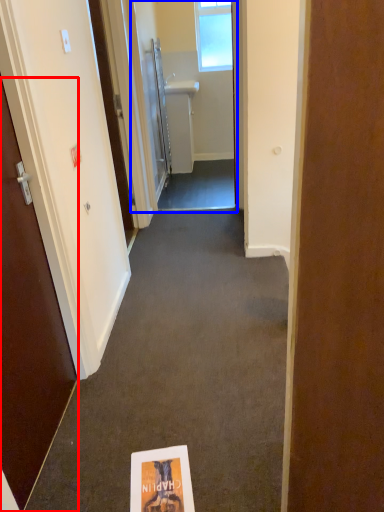
Question: Which of the following is the farthest to the observer, door (highlighted by a red box) or passage (highlighted by a blue box)?

Choices:
 (A) door
 (B) passage

Answer: (B)